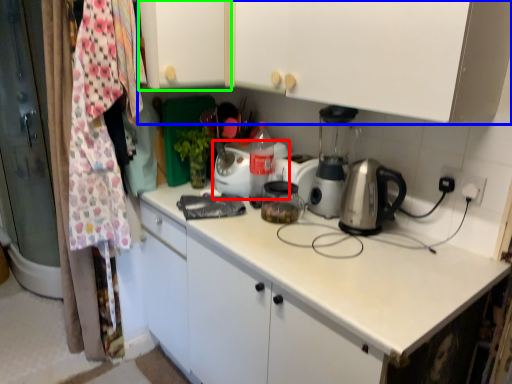
Question: Based on their relative distances, which object is nearer to kitchen appliance (highlighted by a red box)? Choose from cabinetry (highlighted by a blue box) and cabinetry (highlighted by a green box).

Choices:
 (A) cabinetry
 (B) cabinetry

Answer: (B)